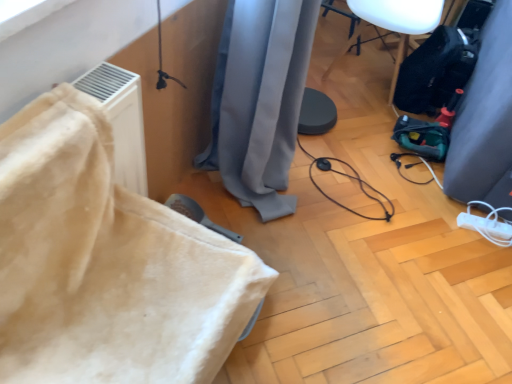
Question: From a real-world perspective, does gray fabric curtain at center, which appears as the second curtain when viewed from the right, stand above white plastic extension cord at lower right?

Choices:
 (A) no
 (B) yes

Answer: (B)

Question: Is gray fabric curtain at center, which appears as the second curtain when viewed from the right, far away from white plastic extension cord at lower right?

Choices:
 (A) no
 (B) yes

Answer: (A)

Question: Does gray fabric curtain at center, marked as the first curtain in a left-to-right arrangement, have a lesser width compared to white plastic extension cord at lower right?

Choices:
 (A) no
 (B) yes

Answer: (A)

Question: Can you confirm if gray fabric curtain at center, marked as the first curtain in a left-to-right arrangement, is positioned to the right of white plastic extension cord at lower right?

Choices:
 (A) no
 (B) yes

Answer: (A)

Question: Is gray fabric curtain at center, which appears as the second curtain when viewed from the right, not inside white plastic extension cord at lower right?

Choices:
 (A) no
 (B) yes

Answer: (B)

Question: Does gray fabric curtain at center, marked as the first curtain in a left-to-right arrangement, turn towards white plastic extension cord at lower right?

Choices:
 (A) no
 (B) yes

Answer: (B)

Question: Considering the relative positions of white plastic extension cord at lower right and black rubber cable at center in the image provided, is white plastic extension cord at lower right to the right of black rubber cable at center from the viewer's perspective?

Choices:
 (A) yes
 (B) no

Answer: (A)

Question: Is white plastic extension cord at lower right in front of black rubber cable at center?

Choices:
 (A) yes
 (B) no

Answer: (B)

Question: Is white plastic extension cord at lower right far away from black rubber cable at center?

Choices:
 (A) no
 (B) yes

Answer: (A)

Question: Is white plastic extension cord at lower right in contact with black rubber cable at center?

Choices:
 (A) yes
 (B) no

Answer: (B)

Question: Considering the relative sizes of white plastic extension cord at lower right and black rubber cable at center in the image provided, is white plastic extension cord at lower right smaller than black rubber cable at center?

Choices:
 (A) yes
 (B) no

Answer: (A)

Question: Is white plastic extension cord at lower right oriented away from black rubber cable at center?

Choices:
 (A) yes
 (B) no

Answer: (B)

Question: Is white plastic extension cord at lower right further to camera compared to black plastic speaker at upper right, positioned as the first furniture in back-to-front order?

Choices:
 (A) yes
 (B) no

Answer: (B)